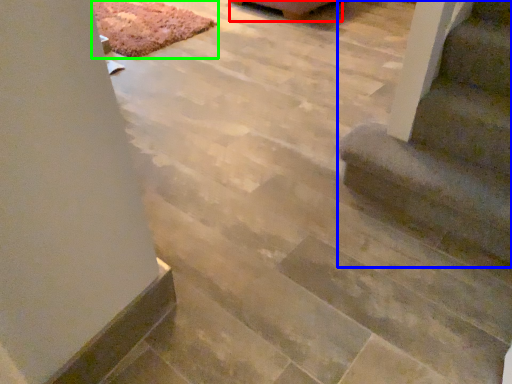
Question: Based on their relative distances, which object is nearer to furniture (highlighted by a red box)? Choose from stairs (highlighted by a blue box) and mat (highlighted by a green box).

Choices:
 (A) stairs
 (B) mat

Answer: (B)